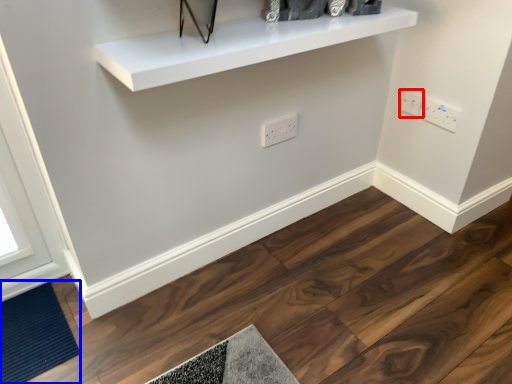
Question: Which object appears farthest to the camera in this image, electric outlet (highlighted by a red box) or doormat (highlighted by a blue box)?

Choices:
 (A) electric outlet
 (B) doormat

Answer: (A)